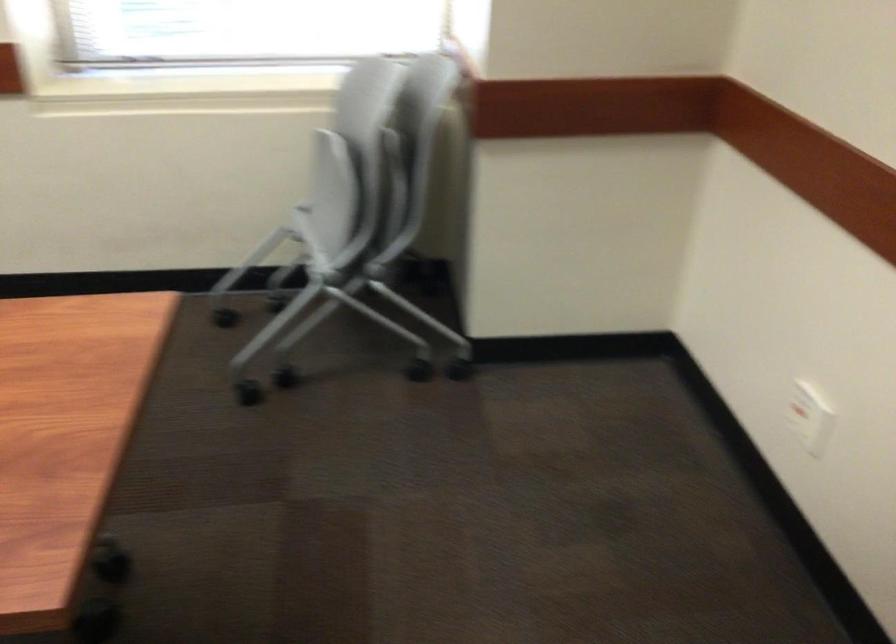
Question: The first image is from the beginning of the video and the second image is from the end. How did the camera likely rotate when shooting the video?

Choices:
 (A) Left
 (B) Right
 (C) Up
 (D) Down

Answer: (B)